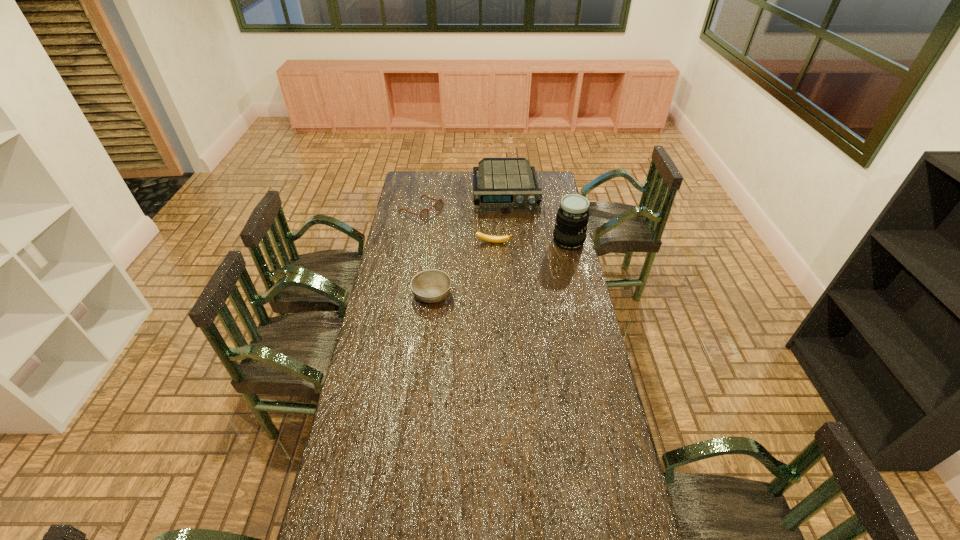
The height and width of the screenshot is (540, 960). Find the location of `free spot between the spectacles and the radio receiver`. free spot between the spectacles and the radio receiver is located at coordinates (464, 201).

I want to click on free space between the spectacles and the telephoto lens, so click(494, 226).

Where is `free space that is in between the spectacles and the rightmost object`? free space that is in between the spectacles and the rightmost object is located at coordinates (494, 226).

This screenshot has height=540, width=960. Identify the location of blank region between the radio receiver and the bowl. (468, 244).

Find the location of a particular element. This screenshot has width=960, height=540. vacant space that's between the rightmost object and the spectacles is located at coordinates [494, 226].

Where is `empty space that is in between the radio receiver and the spectacles`? The width and height of the screenshot is (960, 540). empty space that is in between the radio receiver and the spectacles is located at coordinates (464, 201).

In order to click on vacant point located between the banana and the telephoto lens in this screenshot , I will do `click(531, 242)`.

Locate an element on the screen. The width and height of the screenshot is (960, 540). free space between the banana and the radio receiver is located at coordinates click(x=499, y=218).

Locate an element on the screen. This screenshot has width=960, height=540. object that stands as the second closest to the fourth shortest object is located at coordinates (572, 218).

Identify the location of object that can be found as the closest to the spectacles. This screenshot has height=540, width=960. (506, 185).